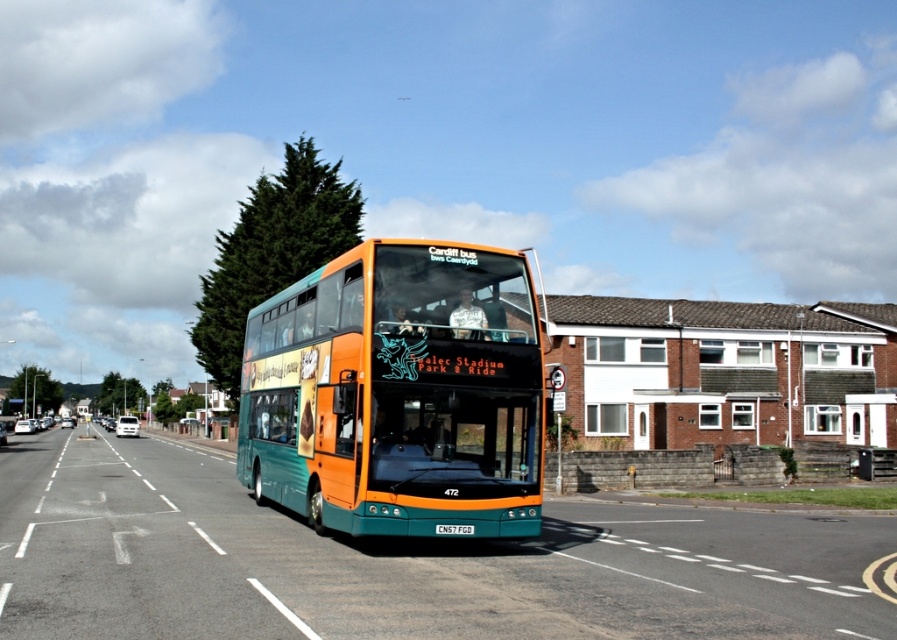
You are a photographer trying to capture a clear photo of the white plastic license plate at center while also including the teal glossy bus at center in the frame. Given their size difference, will the license plate be fully visible in the photo if the bus takes up most of the center?

The teal glossy bus at center is bigger than the white plastic license plate at center. Since the bus takes up most of the center, the license plate may be partially obscured or difficult to see clearly in the photo.

You are standing at the side of the road and see the teal glossy bus at center approaching you. The bus driver says they will stop at the next stop, which is 40 feet away. Can you estimate if the bus will stop before reaching you?

The teal glossy bus at center is currently 36.01 feet away from you. Since the next stop is 40 feet away, the bus will stop after passing your position. Therefore, the bus will not stop before reaching you.

You are a pedestrian standing on the sidewalk and see the teal glossy bus at center and the white plastic license plate at center. Which object is closer to the left side of your view?

The teal glossy bus at center is closer to the left side of your view because it is positioned to the left of the white plastic license plate at center.